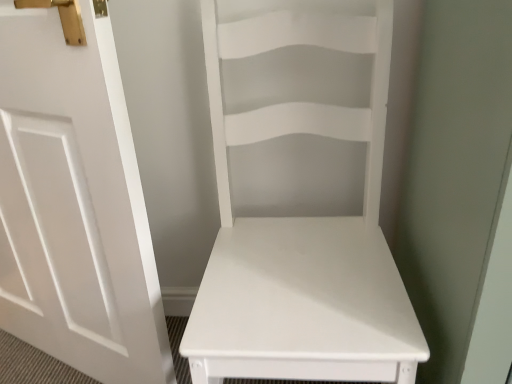
Find the location of a particular element. white matte chair at center is located at coordinates (300, 199).

This screenshot has height=384, width=512. What do you see at coordinates (300, 199) in the screenshot?
I see `white matte chair at center` at bounding box center [300, 199].

Measure the distance between white matte door at left and camera.

white matte door at left and camera are 25.89 inches apart.

The height and width of the screenshot is (384, 512). What do you see at coordinates (74, 204) in the screenshot?
I see `white matte door at left` at bounding box center [74, 204].

This screenshot has width=512, height=384. I want to click on white matte door at left, so click(x=74, y=204).

Image resolution: width=512 pixels, height=384 pixels. Find the location of `white matte chair at center`. white matte chair at center is located at coordinates (300, 199).

Is white matte door at left at the right side of white matte chair at center?

In fact, white matte door at left is to the left of white matte chair at center.

Is white matte door at left in front of or behind white matte chair at center in the image?

white matte door at left is positioned farther from the viewer than white matte chair at center.

Does point (125, 368) come behind point (263, 202)?

No.

From the image's perspective, is white matte door at left above white matte chair at center?

Yes, from the image's perspective, white matte door at left is above white matte chair at center.

From a real-world perspective, relative to white matte chair at center, is white matte door at left vertically above or below?

In terms of real-world spatial position, white matte door at left is above white matte chair at center.

Which of these two, white matte door at left or white matte chair at center, is thinner?

With smaller width is white matte door at left.

Who is shorter, white matte door at left or white matte chair at center?

With less height is white matte chair at center.

Considering the sizes of objects white matte door at left and white matte chair at center in the image provided, who is smaller, white matte door at left or white matte chair at center?

Smaller between the two is white matte door at left.

Consider the image. Is white matte door at left inside or outside of white matte chair at center?

white matte door at left is not inside white matte chair at center, it's outside.

Is white matte door at left next to white matte chair at center and touching it?

No, white matte door at left is not with white matte chair at center.

Could you tell me if white matte door at left is turned towards white matte chair at center?

No, white matte door at left is not turned towards white matte chair at center.

What's the angular difference between white matte door at left and white matte chair at center's facing directions?

They differ by 23.8 degrees in their facing directions.

How far apart are white matte door at left and white matte chair at center?

white matte door at left and white matte chair at center are 37.52 centimeters apart.

In order to click on furniture on the right of white matte door at left in this screenshot , I will do `click(300, 199)`.

In the image, is white matte chair at center on the left side or the right side of white matte door at left?

white matte chair at center is to the right of white matte door at left.

Between white matte chair at center and white matte door at left, which one is positioned behind?

white matte door at left is further from the camera.

Does point (323, 148) come closer to viewer compared to point (96, 270)?

No, it is not.

From the image's perspective, relative to white matte door at left, is white matte chair at center above or below?

Clearly, from the image's perspective, white matte chair at center is below white matte door at left.

From a real-world perspective, is white matte chair at center physically above white matte door at left?

No, from a real-world perspective, white matte chair at center is not on top of white matte door at left.

Which of these two, white matte chair at center or white matte door at left, is wider?

white matte chair at center is wider.

Can you confirm if white matte chair at center is shorter than white matte door at left?

Yes, white matte chair at center is shorter than white matte door at left.

Consider the image. Looking at the image, does white matte chair at center seem bigger or smaller compared to white matte door at left?

white matte chair at center is bigger than white matte door at left.

Could white matte door at left be considered to be inside white matte chair at center?

No, white matte door at left is not a part of white matte chair at center.

Is white matte chair at center far from white matte door at left?

Actually, white matte chair at center and white matte door at left are a little close together.

Is white matte door at left at the back of white matte chair at center?

white matte chair at center is not turned away from white matte door at left.

Find the location of a particular element. The image size is (512, 384). door above the white matte chair at center (from a real-world perspective) is located at coordinates (74, 204).

Find the location of a particular element. The image size is (512, 384). door above the white matte chair at center (from the image's perspective) is located at coordinates (74, 204).

Locate an element on the screen. furniture below the white matte door at left (from a real-world perspective) is located at coordinates (300, 199).